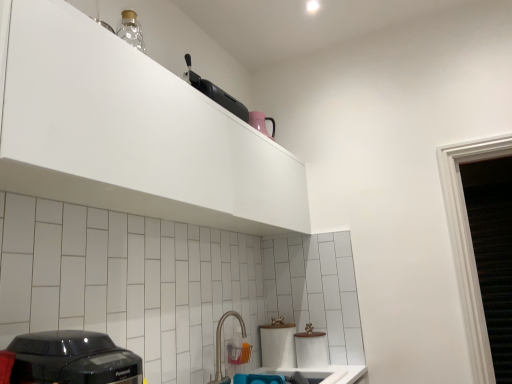
Question: Is white glossy sink at lower center positioned before white matte cabinet at upper center?

Choices:
 (A) no
 (B) yes

Answer: (A)

Question: From the image's perspective, is white glossy sink at lower center above white matte cabinet at upper center?

Choices:
 (A) no
 (B) yes

Answer: (A)

Question: Does white glossy sink at lower center have a larger size compared to white matte cabinet at upper center?

Choices:
 (A) yes
 (B) no

Answer: (B)

Question: Is white glossy sink at lower center touching white matte cabinet at upper center?

Choices:
 (A) no
 (B) yes

Answer: (A)

Question: Is white glossy sink at lower center facing away from white matte cabinet at upper center?

Choices:
 (A) yes
 (B) no

Answer: (B)

Question: Choose the correct answer: Is white glossy sink at lower center inside black plastic toaster at upper center or outside it?

Choices:
 (A) inside
 (B) outside

Answer: (B)

Question: Relative to black plastic toaster at upper center, is white glossy sink at lower center in front or behind?

Choices:
 (A) front
 (B) behind

Answer: (A)

Question: From a real-world perspective, is white glossy sink at lower center physically located above or below black plastic toaster at upper center?

Choices:
 (A) above
 (B) below

Answer: (B)

Question: Considering the positions of white glossy sink at lower center and black plastic toaster at upper center in the image, is white glossy sink at lower center wider or thinner than black plastic toaster at upper center?

Choices:
 (A) wide
 (B) thin

Answer: (A)

Question: From the image's perspective, relative to satin nickel faucet at lower center, is white glossy sink at lower center above or below?

Choices:
 (A) below
 (B) above

Answer: (A)

Question: Would you say white glossy sink at lower center is inside or outside satin nickel faucet at lower center?

Choices:
 (A) inside
 (B) outside

Answer: (B)

Question: Considering the positions of white glossy sink at lower center and satin nickel faucet at lower center in the image, is white glossy sink at lower center taller or shorter than satin nickel faucet at lower center?

Choices:
 (A) short
 (B) tall

Answer: (A)

Question: In the image, is white glossy sink at lower center positioned in front of or behind satin nickel faucet at lower center?

Choices:
 (A) behind
 (B) front

Answer: (B)

Question: From a real-world perspective, is satin nickel faucet at lower center above or below black plastic toaster at lower left?

Choices:
 (A) below
 (B) above

Answer: (A)

Question: Considering their positions, is satin nickel faucet at lower center located in front of or behind black plastic toaster at lower left?

Choices:
 (A) behind
 (B) front

Answer: (A)